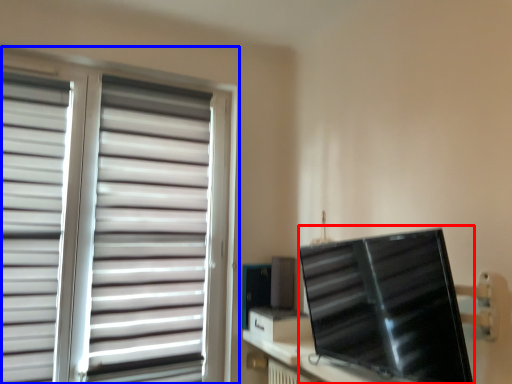
Question: Which object is further to the camera taking this photo, computer monitor (highlighted by a red box) or window blind (highlighted by a blue box)?

Choices:
 (A) computer monitor
 (B) window blind

Answer: (B)